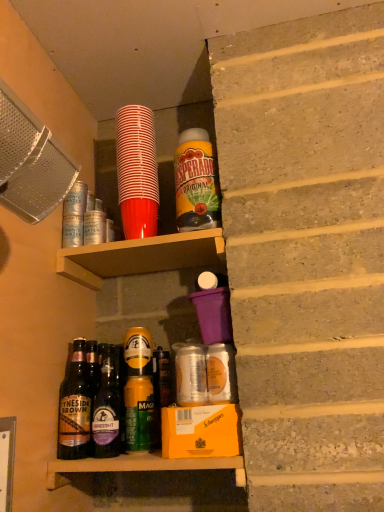
You are a GUI agent. You are given a task and a screenshot of the screen. Output one action in this format:
    pyautogui.click(x=<x>, y=<y>)
    Task: Click on the brown glass bottle at lower left, the first bottle when ordered from left to right
    This screenshot has height=512, width=384.
    Given the screenshot: What is the action you would take?
    pyautogui.click(x=75, y=407)

The image size is (384, 512). What do you see at coordinates (138, 390) in the screenshot?
I see `metallic gold can at center, the 2th bottle when ordered from right to left` at bounding box center [138, 390].

Where is `yellow matte bottle at upper center, which is the 1th bottle in right-to-left order`? The image size is (384, 512). yellow matte bottle at upper center, which is the 1th bottle in right-to-left order is located at coordinates (196, 182).

Measure the distance between red plastic cup at upper center, which is the 3th bottle in right-to-left order, and camera.

They are 37.62 inches apart.

Identify the location of purple plastic cup at upper center. Image resolution: width=384 pixels, height=512 pixels. (141, 256).

Between brown glass bottle at lower left, the first bottle when ordered from left to right, and red plastic cup at upper center, positioned as the 3th bottle in left-to-right order, which one is positioned behind?

red plastic cup at upper center, positioned as the 3th bottle in left-to-right order, is behind.

Consider the image. Considering the relative positions of brown glass bottle at lower left, the first bottle when ordered from left to right, and red plastic cup at upper center, which is the 3th bottle in right-to-left order, in the image provided, is brown glass bottle at lower left, the first bottle when ordered from left to right, to the left of red plastic cup at upper center, which is the 3th bottle in right-to-left order, from the viewer's perspective?

Yes.

Who is taller, brown glass bottle at lower left, the first bottle when ordered from left to right, or red plastic cup at upper center, positioned as the 3th bottle in left-to-right order?

Standing taller between the two is red plastic cup at upper center, positioned as the 3th bottle in left-to-right order.

Considering the sizes of objects brown glass bottle at lower left, the first bottle when ordered from left to right, and red plastic cup at upper center, positioned as the 3th bottle in left-to-right order, in the image provided, who is wider, brown glass bottle at lower left, the first bottle when ordered from left to right, or red plastic cup at upper center, positioned as the 3th bottle in left-to-right order,?

red plastic cup at upper center, positioned as the 3th bottle in left-to-right order, is wider.

In the scene shown: Between brown glass bottle at lower left, the first bottle when ordered from left to right, and purple plastic cup at upper center, which one is positioned behind?

purple plastic cup at upper center is further from the camera.

Is point (73, 346) farther from camera compared to point (203, 249)?

That is False.

From the image's perspective, which one is positioned lower, brown glass bottle at lower left, the first bottle when ordered from left to right, or purple plastic cup at upper center?

From the image's view, brown glass bottle at lower left, the first bottle when ordered from left to right, is below.

Can you confirm if brown glass bottle at lower left, the first bottle when ordered from left to right, is shorter than purple plastic cup at upper center?

In fact, brown glass bottle at lower left, the first bottle when ordered from left to right, may be taller than purple plastic cup at upper center.

Is metallic gold can at center, which is counted as the fourth bottle, starting from the left, placed right next to yellow matte bottle at upper center, which is the 1th bottle in right-to-left order?

No, metallic gold can at center, which is counted as the fourth bottle, starting from the left, is not in contact with yellow matte bottle at upper center, which is the 1th bottle in right-to-left order.

From a real-world perspective, which is physically above, metallic gold can at center, the 2th bottle when ordered from right to left, or yellow matte bottle at upper center, arranged as the 5th bottle when viewed from the left?

yellow matte bottle at upper center, arranged as the 5th bottle when viewed from the left, from a real-world perspective.

Would you say metallic gold can at center, the 2th bottle when ordered from right to left, is outside yellow matte bottle at upper center, arranged as the 5th bottle when viewed from the left?

That's correct, metallic gold can at center, the 2th bottle when ordered from right to left, is outside of yellow matte bottle at upper center, arranged as the 5th bottle when viewed from the left.

Between point (143, 406) and point (190, 158), which one is positioned in front?

Point (143, 406)

Could red plastic cup at upper center, positioned as the 3th bottle in left-to-right order, be considered to be inside metallic gold can at center, the 2th bottle when ordered from right to left?

No, red plastic cup at upper center, positioned as the 3th bottle in left-to-right order, is not a part of metallic gold can at center, the 2th bottle when ordered from right to left.

Can you confirm if metallic gold can at center, which is counted as the fourth bottle, starting from the left, is wider than red plastic cup at upper center, which is the 3th bottle in right-to-left order?

In fact, metallic gold can at center, which is counted as the fourth bottle, starting from the left, might be narrower than red plastic cup at upper center, which is the 3th bottle in right-to-left order.

Is the depth of dark brown glass bottle at center, the fourth bottle from the right, less than that of red plastic cup at upper center, which is the 3th bottle in right-to-left order?

Yes, dark brown glass bottle at center, the fourth bottle from the right, is closer to the viewer.

Looking at this image, is dark brown glass bottle at center, positioned as the 2th bottle in left-to-right order, smaller than red plastic cup at upper center, which is the 3th bottle in right-to-left order?

Indeed, dark brown glass bottle at center, positioned as the 2th bottle in left-to-right order, has a smaller size compared to red plastic cup at upper center, which is the 3th bottle in right-to-left order.

Does dark brown glass bottle at center, the fourth bottle from the right, appear on the right side of red plastic cup at upper center, which is the 3th bottle in right-to-left order?

No.

Is point (104, 448) farther from viewer compared to point (146, 374)?

No, it is in front of (146, 374).

Which of these two, dark brown glass bottle at center, the fourth bottle from the right, or metallic gold can at center, the 2th bottle when ordered from right to left, is smaller?

metallic gold can at center, the 2th bottle when ordered from right to left.

Looking at this image, could you tell me if dark brown glass bottle at center, positioned as the 2th bottle in left-to-right order, is turned towards metallic gold can at center, which is counted as the fourth bottle, starting from the left?

No, dark brown glass bottle at center, positioned as the 2th bottle in left-to-right order, does not turn towards metallic gold can at center, which is counted as the fourth bottle, starting from the left.

Is dark brown glass bottle at center, positioned as the 2th bottle in left-to-right order, far away from metallic gold can at center, which is counted as the fourth bottle, starting from the left?

No.

Who is smaller, purple plastic cup at upper center or red plastic cup at upper center, positioned as the 3th bottle in left-to-right order?

red plastic cup at upper center, positioned as the 3th bottle in left-to-right order.

Choose the correct answer: Is purple plastic cup at upper center inside red plastic cup at upper center, positioned as the 3th bottle in left-to-right order, or outside it?

The correct answer is: outside.

Which object is closer to the camera, purple plastic cup at upper center or red plastic cup at upper center, which is the 3th bottle in right-to-left order?

purple plastic cup at upper center is closer to the camera.

Are purple plastic cup at upper center and red plastic cup at upper center, positioned as the 3th bottle in left-to-right order, beside each other?

purple plastic cup at upper center is not next to red plastic cup at upper center, positioned as the 3th bottle in left-to-right order, and they're not touching.

There is a red plastic cup at upper center, positioned as the 3th bottle in left-to-right order. At what (x,y) coordinates should I click in order to perform the action: click on the 2nd bottle below it (from a real-world perspective). Please return your answer as a coordinate pair (x, y). Looking at the image, I should click on (75, 407).

I want to click on shelf above the brown glass bottle at lower left, the first bottle when ordered from left to right (from the image's perspective), so click(x=141, y=256).

Looking at the image, which one is located closer to yellow matte bottle at upper center, arranged as the 5th bottle when viewed from the left, purple plastic cup at upper center or red plastic cup at upper center, positioned as the 3th bottle in left-to-right order?

The object closer to yellow matte bottle at upper center, arranged as the 5th bottle when viewed from the left, is red plastic cup at upper center, positioned as the 3th bottle in left-to-right order.

Estimate the real-world distances between objects in this image. Which object is further from purple plastic cup at upper center, yellow matte bottle at upper center, which is the 1th bottle in right-to-left order, or dark brown glass bottle at center, the fourth bottle from the right?

dark brown glass bottle at center, the fourth bottle from the right, lies further to purple plastic cup at upper center than the other object.

Looking at this image, based on their spatial positions, is brown glass bottle at lower left, the fifth bottle from the right, or metallic gold can at center, the 2th bottle when ordered from right to left, further from red plastic cup at upper center, which is the 3th bottle in right-to-left order?

Based on the image, brown glass bottle at lower left, the fifth bottle from the right, appears to be further to red plastic cup at upper center, which is the 3th bottle in right-to-left order.

When comparing their distances from brown glass bottle at lower left, the first bottle when ordered from left to right, does purple plastic cup at upper center or yellow matte bottle at upper center, arranged as the 5th bottle when viewed from the left, seem further?

yellow matte bottle at upper center, arranged as the 5th bottle when viewed from the left, lies further to brown glass bottle at lower left, the first bottle when ordered from left to right, than the other object.

Which object lies nearer to the anchor point red plastic cup at upper center, positioned as the 3th bottle in left-to-right order, dark brown glass bottle at center, positioned as the 2th bottle in left-to-right order, or yellow matte bottle at upper center, arranged as the 5th bottle when viewed from the left?

yellow matte bottle at upper center, arranged as the 5th bottle when viewed from the left.

Estimate the real-world distances between objects in this image. Which object is closer to yellow matte bottle at upper center, which is the 1th bottle in right-to-left order, metallic gold can at center, which is counted as the fourth bottle, starting from the left, or brown glass bottle at lower left, the fifth bottle from the right?

metallic gold can at center, which is counted as the fourth bottle, starting from the left, is positioned closer to the anchor yellow matte bottle at upper center, which is the 1th bottle in right-to-left order.

Considering their positions, is yellow matte bottle at upper center, which is the 1th bottle in right-to-left order, positioned further to metallic gold can at center, the 2th bottle when ordered from right to left, than dark brown glass bottle at center, positioned as the 2th bottle in left-to-right order?

Among the two, yellow matte bottle at upper center, which is the 1th bottle in right-to-left order, is located further to metallic gold can at center, the 2th bottle when ordered from right to left.

In the scene shown: From the image, which object appears to be nearer to yellow matte bottle at upper center, arranged as the 5th bottle when viewed from the left, brown glass bottle at lower left, the first bottle when ordered from left to right, or dark brown glass bottle at center, positioned as the 2th bottle in left-to-right order?

dark brown glass bottle at center, positioned as the 2th bottle in left-to-right order, lies closer to yellow matte bottle at upper center, arranged as the 5th bottle when viewed from the left, than the other object.

Locate an element on the screen. The height and width of the screenshot is (512, 384). shelf between yellow matte bottle at upper center, arranged as the 5th bottle when viewed from the left, and brown glass bottle at lower left, the first bottle when ordered from left to right, in the vertical direction is located at coordinates (141, 256).

What are the coordinates of `bottle between yellow matte bottle at upper center, arranged as the 5th bottle when viewed from the left, and brown glass bottle at lower left, the first bottle when ordered from left to right, vertically` in the screenshot? It's located at (107, 407).

You are a GUI agent. You are given a task and a screenshot of the screen. Output one action in this format:
    pyautogui.click(x=<x>, y=<y>)
    Task: Click on the bottle between red plastic cup at upper center, positioned as the 3th bottle in left-to-right order, and purple plastic cup at upper center vertically
    The width and height of the screenshot is (384, 512).
    Given the screenshot: What is the action you would take?
    pyautogui.click(x=196, y=182)

This screenshot has width=384, height=512. In order to click on shelf between red plastic cup at upper center, positioned as the 3th bottle in left-to-right order, and metallic gold can at center, the 2th bottle when ordered from right to left, vertically in this screenshot , I will do `click(141, 256)`.